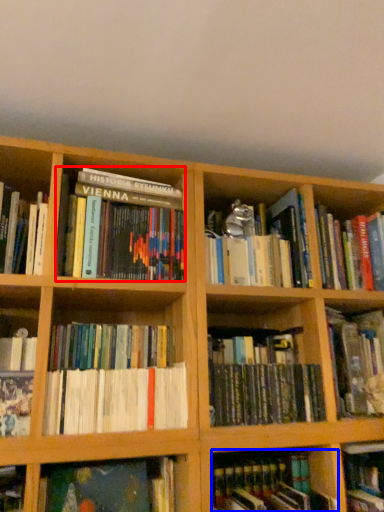
Question: Which object is closer to the camera taking this photo, book (highlighted by a red box) or book (highlighted by a blue box)?

Choices:
 (A) book
 (B) book

Answer: (B)